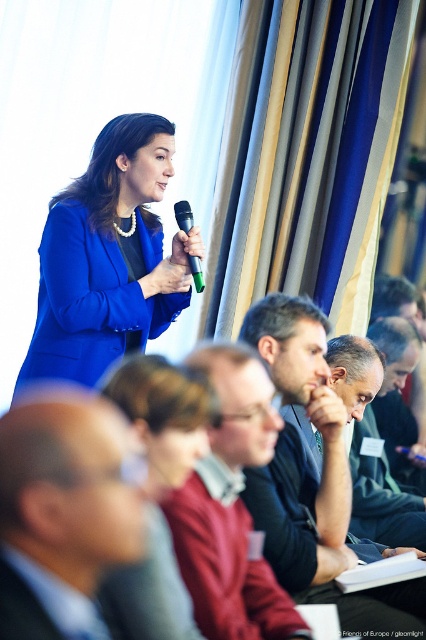
You are organizing a photo shoot and need to adjust the positioning of the two matte blue suits in the scene. The camera is positioned to capture both subjects clearly. Given that the minimum required distance between subjects for optimal focus is 30 inches, will the current spacing between the matte blue suit at center and the matte blue suit at upper left allow for clear focus?

The distance between the matte blue suit at center and the matte blue suit at upper left is 33.69 inches, which exceeds the minimum required 30 inches for optimal focus. Therefore, the current spacing allows for clear focus.

You are a photographer at the event and want to take a photo of the green plastic microphone at upper center without any obstructions. Is the dark gray sweater at center blocking your view of the microphone?

The dark gray sweater at center is in front of the green plastic microphone at upper center, so it is blocking the view of the microphone. Move to a position where the sweater is not between you and the microphone to capture an unobstructed shot.